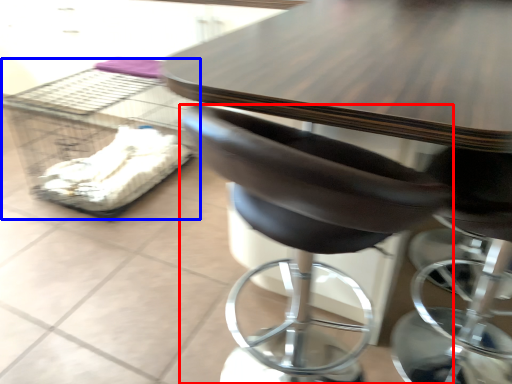
Question: Which object appears closest to the camera in this image, chair (highlighted by a red box) or crate (highlighted by a blue box)?

Choices:
 (A) chair
 (B) crate

Answer: (A)